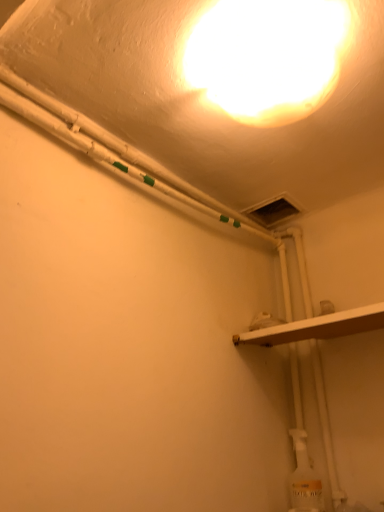
Image resolution: width=384 pixels, height=512 pixels. Describe the element at coordinates (317, 327) in the screenshot. I see `white matte shelf at lower right` at that location.

Where is `white matte shelf at lower right`? The height and width of the screenshot is (512, 384). white matte shelf at lower right is located at coordinates (317, 327).

In order to face white matte shelf at lower right, should I rotate leftwards or rightwards?

Rotate your view right by about 16.971°.

Image resolution: width=384 pixels, height=512 pixels. Identify the location of white glossy light fixture at upper center. (268, 57).

The height and width of the screenshot is (512, 384). What do you see at coordinates (268, 57) in the screenshot? I see `white glossy light fixture at upper center` at bounding box center [268, 57].

In order to face white glossy light fixture at upper center, should I rotate leftwards or rightwards?

To face it directly, rotate right by 11.457 degrees.

This screenshot has width=384, height=512. I want to click on white matte shelf at lower right, so click(x=317, y=327).

Which object is positioned more to the left, white glossy light fixture at upper center or white matte shelf at lower right?

white glossy light fixture at upper center is more to the left.

Which object is further away from the camera taking this photo, white glossy light fixture at upper center or white matte shelf at lower right?

white matte shelf at lower right is further away from the camera.

Considering the points (208, 80) and (337, 331), which point is behind, point (208, 80) or point (337, 331)?

Point (337, 331)

From the image's perspective, which object appears higher, white glossy light fixture at upper center or white matte shelf at lower right?

white glossy light fixture at upper center appears higher in the image.

From a real-world perspective, which is physically above, white glossy light fixture at upper center or white matte shelf at lower right?

From a 3D spatial view, white glossy light fixture at upper center is above.

Between white glossy light fixture at upper center and white matte shelf at lower right, which one has smaller width?

Thinner between the two is white glossy light fixture at upper center.

Who is shorter, white glossy light fixture at upper center or white matte shelf at lower right?

white matte shelf at lower right.

Between white glossy light fixture at upper center and white matte shelf at lower right, which one has larger size?

white glossy light fixture at upper center is bigger.

Is white matte shelf at lower right located within white glossy light fixture at upper center?

That's incorrect, white matte shelf at lower right is not inside white glossy light fixture at upper center.

Does white glossy light fixture at upper center touch white matte shelf at lower right?

No, white glossy light fixture at upper center is not with white matte shelf at lower right.

Is white glossy light fixture at upper center facing towards white matte shelf at lower right?

No, white glossy light fixture at upper center is not aimed at white matte shelf at lower right.

How many degrees apart are the facing directions of white glossy light fixture at upper center and white matte shelf at lower right?

There is a 1.46-degree angle between the facing directions of white glossy light fixture at upper center and white matte shelf at lower right.

The height and width of the screenshot is (512, 384). What are the coordinates of `shelf below the white glossy light fixture at upper center (from the image's perspective)` in the screenshot? It's located at (317, 327).

Does white matte shelf at lower right appear on the right side of white glossy light fixture at upper center?

Yes.

In the image, is white matte shelf at lower right positioned in front of or behind white glossy light fixture at upper center?

Visually, white matte shelf at lower right is located behind white glossy light fixture at upper center.

Does point (366, 316) come behind point (196, 44)?

Yes, it is behind point (196, 44).

From the image's perspective, which one is positioned lower, white matte shelf at lower right or white glossy light fixture at upper center?

white matte shelf at lower right, from the image's perspective.

From a real-world perspective, relative to white glossy light fixture at upper center, is white matte shelf at lower right vertically above or below?

From a real-world perspective, white matte shelf at lower right is physically below white glossy light fixture at upper center.

Can you confirm if white matte shelf at lower right is wider than white glossy light fixture at upper center?

Yes, white matte shelf at lower right is wider than white glossy light fixture at upper center.

Is white matte shelf at lower right taller than white glossy light fixture at upper center?

In fact, white matte shelf at lower right may be shorter than white glossy light fixture at upper center.

Considering the sizes of objects white matte shelf at lower right and white glossy light fixture at upper center in the image provided, who is smaller, white matte shelf at lower right or white glossy light fixture at upper center?

With smaller size is white matte shelf at lower right.

Is white matte shelf at lower right positioned beyond the bounds of white glossy light fixture at upper center?

That's correct, white matte shelf at lower right is outside of white glossy light fixture at upper center.

Are white matte shelf at lower right and white glossy light fixture at upper center located far from each other?

No, white matte shelf at lower right is not far from white glossy light fixture at upper center.

Is white glossy light fixture at upper center at the back of white matte shelf at lower right?

No, white matte shelf at lower right's orientation is not away from white glossy light fixture at upper center.

Looking at this image, how many degrees apart are the facing directions of white matte shelf at lower right and white glossy light fixture at upper center?

The facing directions of white matte shelf at lower right and white glossy light fixture at upper center are 1.46 degrees apart.

At what (x,y) coordinates should I click in order to perform the action: click on shelf located on the right of white glossy light fixture at upper center. Please return your answer as a coordinate pair (x, y). The image size is (384, 512). Looking at the image, I should click on (317, 327).

In the image, there is a white matte shelf at lower right. Identify the location of lamp above it (from the image's perspective). The width and height of the screenshot is (384, 512). (268, 57).

At what (x,y) coordinates should I click in order to perform the action: click on lamp in front of the white matte shelf at lower right. Please return your answer as a coordinate pair (x, y). This screenshot has width=384, height=512. Looking at the image, I should click on (268, 57).